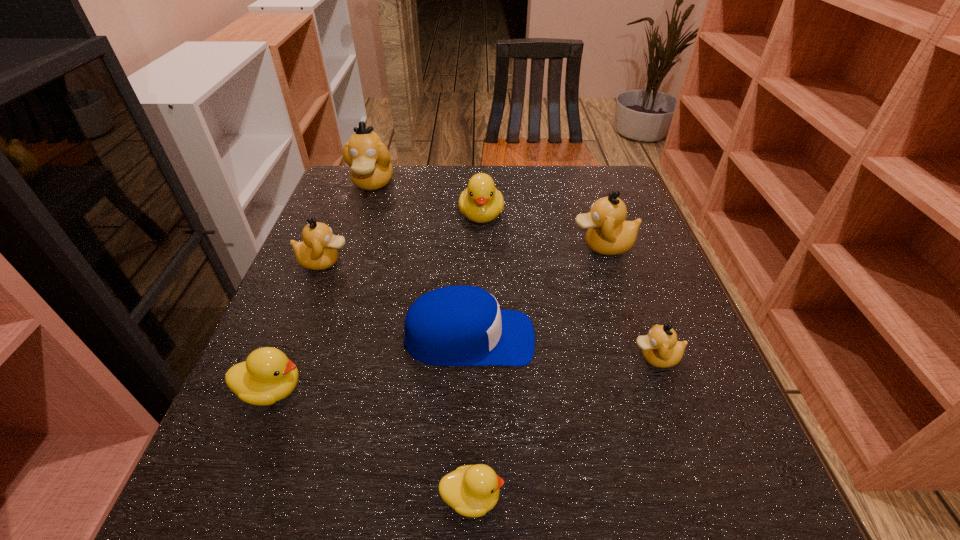
Locate an element on the screen. blank space at the far left corner of the desktop is located at coordinates (352, 193).

Where is `free region at the far right corner of the desktop`? free region at the far right corner of the desktop is located at coordinates (599, 188).

You are a GUI agent. You are given a task and a screenshot of the screen. Output one action in this format:
    pyautogui.click(x=<x>, y=<y>)
    Task: Click on the vacant space in between the smallest tan duckling and the nearest object
    This screenshot has height=540, width=960.
    Given the screenshot: What is the action you would take?
    pyautogui.click(x=564, y=427)

At what (x,y) coordinates should I click in order to perform the action: click on unoccupied area between the second smallest yellow duckling and the smallest tan duckling. Please return your answer as a coordinate pair (x, y). Image resolution: width=960 pixels, height=540 pixels. Looking at the image, I should click on (464, 374).

You are a GUI agent. You are given a task and a screenshot of the screen. Output one action in this format:
    pyautogui.click(x=<x>, y=<y>)
    Task: Click on the vacant area that lies between the baseball cap and the tallest duckling
    The height and width of the screenshot is (540, 960).
    Given the screenshot: What is the action you would take?
    pyautogui.click(x=420, y=261)

Where is `free point between the second biggest yellow duckling and the nearest tan duckling`? free point between the second biggest yellow duckling and the nearest tan duckling is located at coordinates (464, 374).

Where is `vacant region between the second tallest object and the nearest tan duckling`? vacant region between the second tallest object and the nearest tan duckling is located at coordinates (629, 302).

At what (x,y) coordinates should I click in order to perform the action: click on free space between the baseball cap and the smallest yellow duckling. Please return your answer as a coordinate pair (x, y). Looking at the image, I should click on (470, 418).

Identify which object is located as the third nearest to the shortest duckling. Please provide its 2D coordinates. Your answer should be formatted as a tuple, i.e. [(x, y)], where the tuple contains the x and y coordinates of a point satisfying the conditions above.

[(661, 349)]

Find the location of a particular element. object that is the third closest one to the second smallest tan duckling is located at coordinates (267, 376).